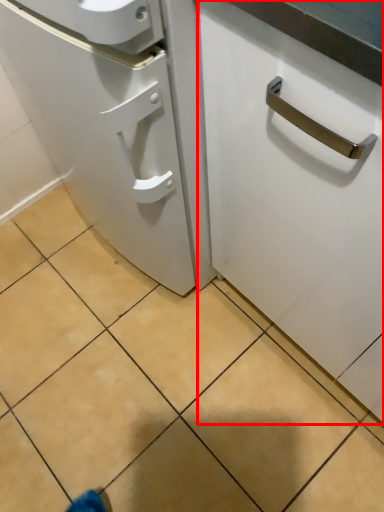
Question: From the image's perspective, what is the correct spatial positioning of cabinetry (annotated by the red box) in reference to tile?

Choices:
 (A) above
 (B) below

Answer: (A)